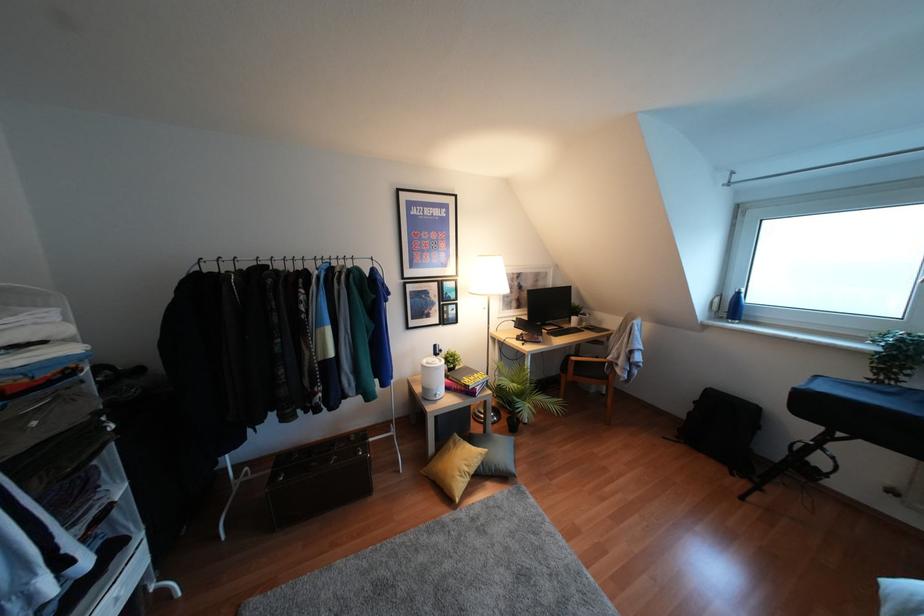
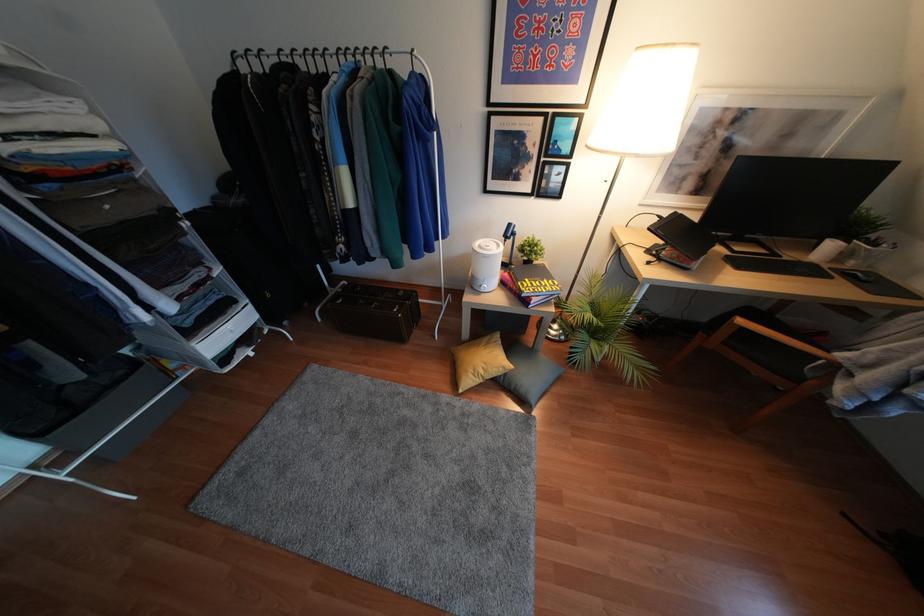
Find the pixel in the second image that matches (452,350) in the first image.

(536, 237)